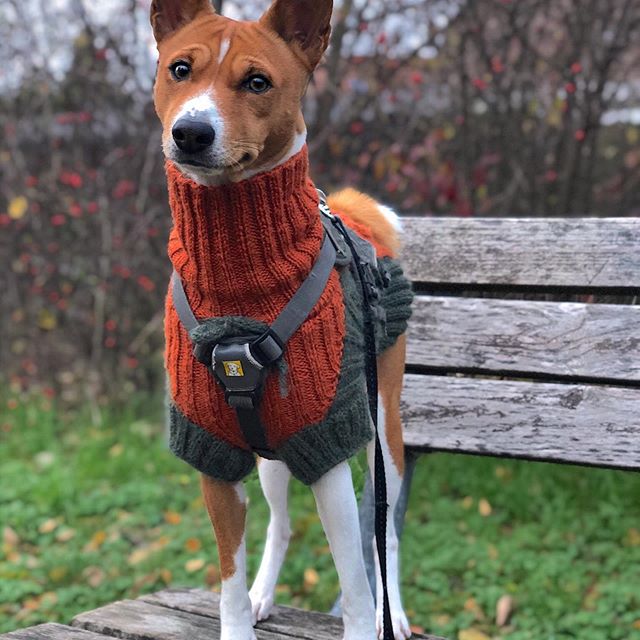
You are a GUI agent. You are given a task and a screenshot of the screen. Output one action in this format:
    pyautogui.click(x=<x>, y=<y>)
    Task: Click on the right front leg
    The height and width of the screenshot is (640, 640).
    Given the screenshot: What is the action you would take?
    pyautogui.click(x=223, y=532)